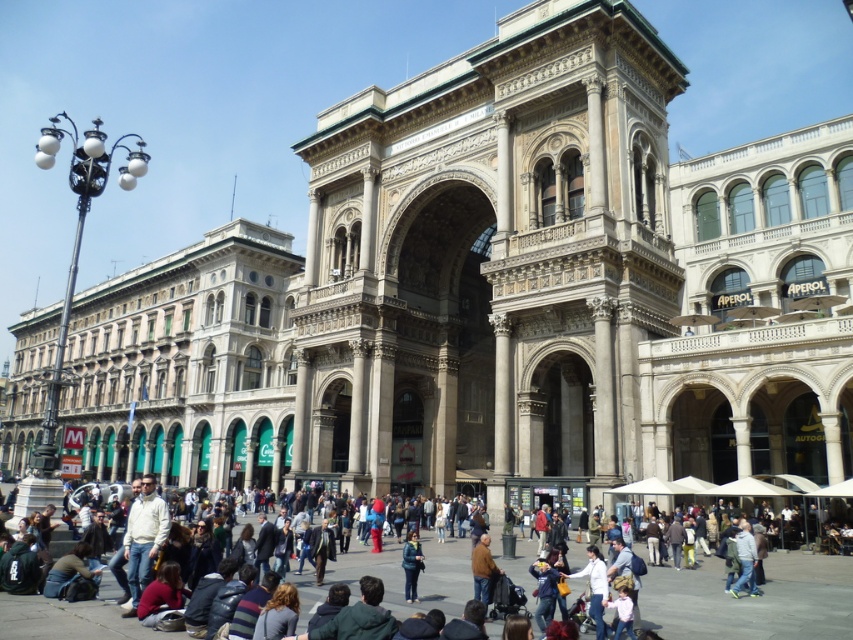
Who is shorter, blue denim jacket at center or white matte jacket at lower left?

Standing shorter between the two is blue denim jacket at center.

Consider the image. Does blue denim jacket at center have a lesser height compared to white matte jacket at lower left?

Correct, blue denim jacket at center is not as tall as white matte jacket at lower left.

The image size is (853, 640). What do you see at coordinates (752, 600) in the screenshot? I see `blue denim jacket at center` at bounding box center [752, 600].

You are a GUI agent. You are given a task and a screenshot of the screen. Output one action in this format:
    pyautogui.click(x=<x>, y=<y>)
    Task: Click on the blue denim jacket at center
    The height and width of the screenshot is (640, 853).
    Given the screenshot: What is the action you would take?
    pyautogui.click(x=752, y=600)

Can you confirm if blue denim jacket at center is smaller than dark blue denim jacket at center?

Actually, blue denim jacket at center might be larger than dark blue denim jacket at center.

Is blue denim jacket at center to the right of dark blue denim jacket at center from the viewer's perspective?

Indeed, blue denim jacket at center is positioned on the right side of dark blue denim jacket at center.

Find the location of a particular element. blue denim jacket at center is located at coordinates (752, 600).

Identify the location of blue denim jacket at center. (752, 600).

Describe the element at coordinates (143, 538) in the screenshot. Image resolution: width=853 pixels, height=640 pixels. I see `white matte jacket at lower left` at that location.

Does point (151, 488) lie behind point (413, 544)?

No.

This screenshot has width=853, height=640. Identify the location of white matte jacket at lower left. (143, 538).